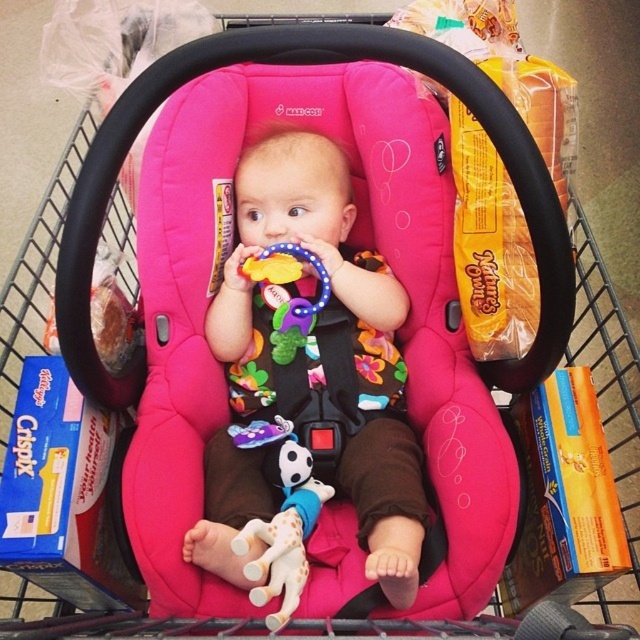
Question: Among these points, which one is nearest to the camera?

Choices:
 (A) (248, 273)
 (B) (262, 568)
 (C) (289, 593)

Answer: (B)

Question: Is matte pink car seat at center to the right of rubberized plastic teething ring at center from the viewer's perspective?

Choices:
 (A) no
 (B) yes

Answer: (B)

Question: Which of the following is the closest to the observer?

Choices:
 (A) matte pink car seat at center
 (B) white plush giraffe at center
 (C) rubberized plastic teething ring at center

Answer: (B)

Question: Can you confirm if white plush giraffe at center is positioned above rubberized plastic teething ring at center?

Choices:
 (A) yes
 (B) no

Answer: (B)

Question: Is matte pink car seat at center below white plush giraffe at center?

Choices:
 (A) no
 (B) yes

Answer: (A)

Question: Estimate the real-world distances between objects in this image. Which object is closer to the white plush giraffe at center?

Choices:
 (A) rubberized plastic teething ring at center
 (B) matte pink car seat at center

Answer: (B)